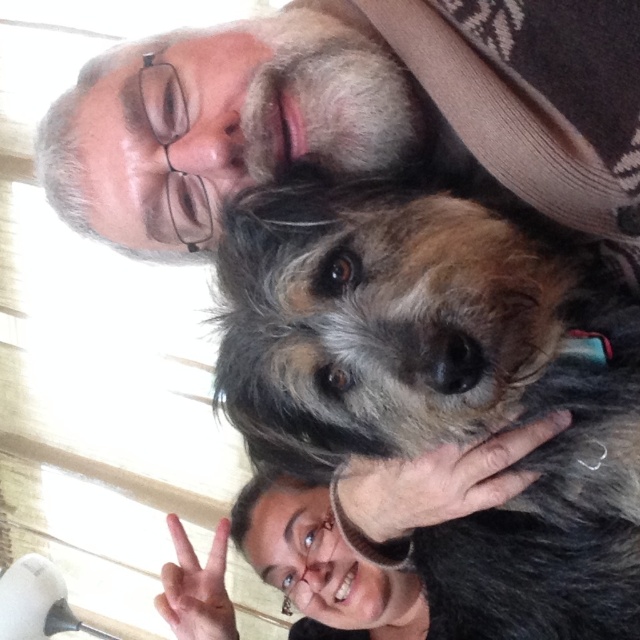
You are taking a photo of the fuzzy brown dog at center and the gray beard at upper center. Which object is closer to the camera?

The fuzzy brown dog at center is closer to the viewer than the gray beard at upper center.

You are a photographer who wants to ensure that the fuzzy brown dog at center and the gray beard at upper center are clearly visible in a portrait. Given their current distance of 6.37 inches, what is the minimum focal length you should use if your camera has a sensor size of 36mm x 24mm and you want to maintain both subjects within the frame without distortion?

The minimum focal length required would depend on the desired field of view and sensor size. However, with the given distance of 6.37 inches between the fuzzy brown dog at center and the gray beard at upper center, a focal length between 50mm to 85mm is typically recommended for portraits to keep both subjects in frame while minimizing distortion.

Based on the scene description, where is the fuzzy brown dog at center positioned relative to the gray beard at upper center?

The fuzzy brown dog at center is located below the gray beard at upper center.